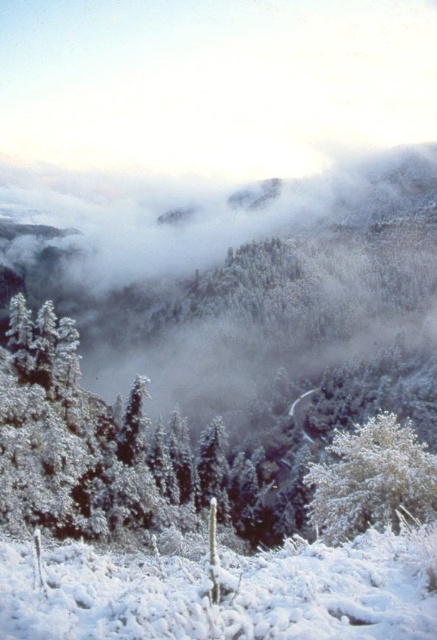
You are an explorer trying to navigate through the winter landscape. You see the white fluffy snow at lower center and the white frosty tree at lower right. Which one is closer to you?

The white fluffy snow at lower center is closer to you because it is positioned over the white frosty tree at lower right.

You are an explorer trying to navigate through the snowy forest. You see the white fluffy snow at lower center and the white frosty tree at lower right. Which one is closer to you?

The white fluffy snow at lower center is closer to you because it is in front of the white frosty tree at lower right.

You are an explorer trying to navigate through the winter landscape. You see the white fluffy snow at lower center and the white frosty tree at lower right. Which object is taller?

The white frosty tree at lower right is taller than the white fluffy snow at lower center.